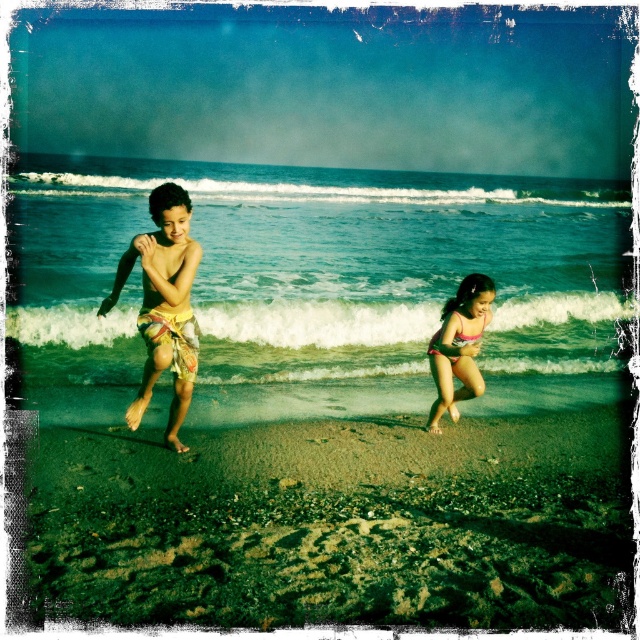
You are a photographer standing at the center of the beach, wanting to capture both the yellow patterned sarong at left and the pink fabric swimsuit at right in a single photo. Given that your camera has a maximum horizontal field of view of 2 meters, can you fit both objects in the frame without moving?

The yellow patterned sarong at left and pink fabric swimsuit at right are 2.65 meters apart from each other. Since the camera can only capture 2 meters horizontally, the distance between them exceeds the camera capabilities. Therefore, you cannot fit both in the frame without moving.

You are a photographer trying to capture a photo of the pink fabric swimsuit at right and the brown sandy beach at lower center. Which object should you focus on first if you want to include both in the same frame without moving the camera?

The brown sandy beach at lower center is positioned under the pink fabric swimsuit at right, so you should focus on the pink fabric swimsuit at right first since it is closer to the camera.

You are a photographer trying to capture the beach scene. You need to ensure that the blue water at center and the yellow patterned sarong at left are both visible in your shot. Based on their heights, which object will appear taller in the photo?

The blue water at center will appear taller in the photo because it has a greater height compared to the yellow patterned sarong at left.